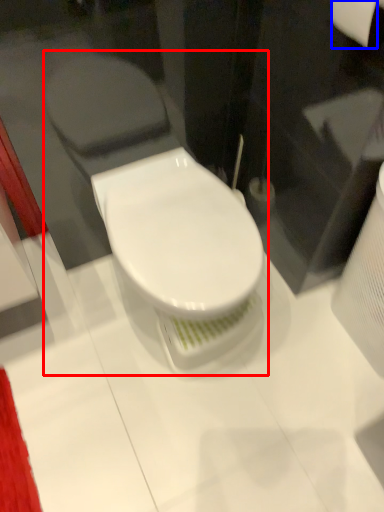
Question: Among these objects, which one is nearest to the camera, toilet (highlighted by a red box) or toilet paper (highlighted by a blue box)?

Choices:
 (A) toilet
 (B) toilet paper

Answer: (B)